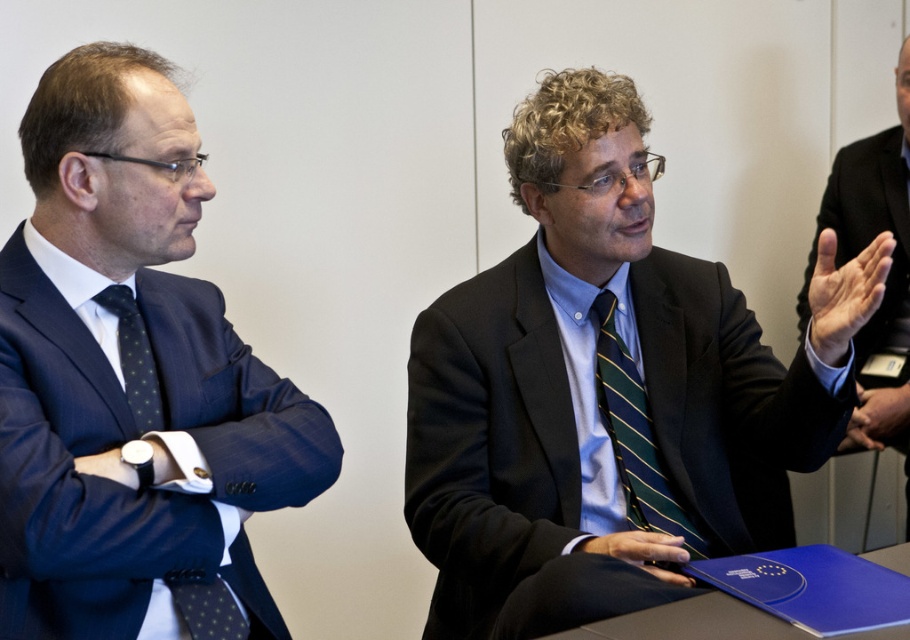
Is point (563, 419) closer to camera compared to point (117, 304)?

No, it is behind (117, 304).

Does point (450, 289) lie behind point (124, 323)?

Yes, point (450, 289) is behind point (124, 323).

Is point (514, 385) in front of point (127, 324)?

No, it is behind (127, 324).

Identify the location of matte black suit at center. The image size is (910, 640). (604, 388).

Can you confirm if matte black suit at center is taller than matte blue suit at left?

Yes.

What do you see at coordinates (604, 388) in the screenshot? The image size is (910, 640). I see `matte black suit at center` at bounding box center [604, 388].

Is point (471, 628) in front of point (201, 440)?

No, it is not.

Where is `matte black suit at center`? The width and height of the screenshot is (910, 640). matte black suit at center is located at coordinates (604, 388).

Can you confirm if black suit at center is positioned below green striped tie at center?

No, black suit at center is not below green striped tie at center.

Image resolution: width=910 pixels, height=640 pixels. I want to click on black suit at center, so click(886, 275).

The image size is (910, 640). In order to click on black suit at center in this screenshot , I will do `click(886, 275)`.